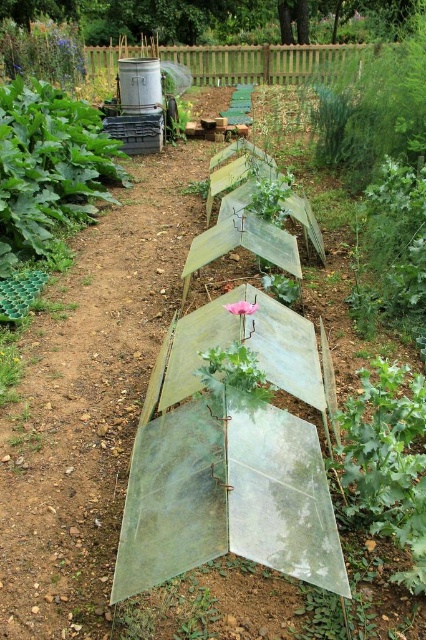
Is green leafy plant at upper left smaller than green leafy plant at center?

No, green leafy plant at upper left is not smaller than green leafy plant at center.

From the picture: Can you confirm if green leafy plant at upper left is wider than green leafy plant at center?

Correct, the width of green leafy plant at upper left exceeds that of green leafy plant at center.

This screenshot has height=640, width=426. Find the location of `green leafy plant at upper left`. green leafy plant at upper left is located at coordinates (48, 166).

Does point (190, 225) lie in front of point (74, 209)?

Yes, point (190, 225) is closer to viewer.

Is transparent plastic sheet at center smaller than green leafy plant at upper left?

Correct, transparent plastic sheet at center occupies less space than green leafy plant at upper left.

What do you see at coordinates (89, 403) in the screenshot? Image resolution: width=426 pixels, height=640 pixels. I see `transparent plastic sheet at center` at bounding box center [89, 403].

What are the coordinates of `transparent plastic sheet at center` in the screenshot? It's located at (89, 403).

Does transparent plastic sheet at center have a greater height compared to green leafy plant at center?

Indeed, transparent plastic sheet at center has a greater height compared to green leafy plant at center.

Who is higher up, transparent plastic sheet at center or green leafy plant at center?

transparent plastic sheet at center

The image size is (426, 640). Describe the element at coordinates (89, 403) in the screenshot. I see `transparent plastic sheet at center` at that location.

You are a GUI agent. You are given a task and a screenshot of the screen. Output one action in this format:
    pyautogui.click(x=<x>, y=<y>)
    Task: Click on the transparent plastic sheet at center
    The image size is (426, 640).
    Given the screenshot: What is the action you would take?
    pyautogui.click(x=89, y=403)